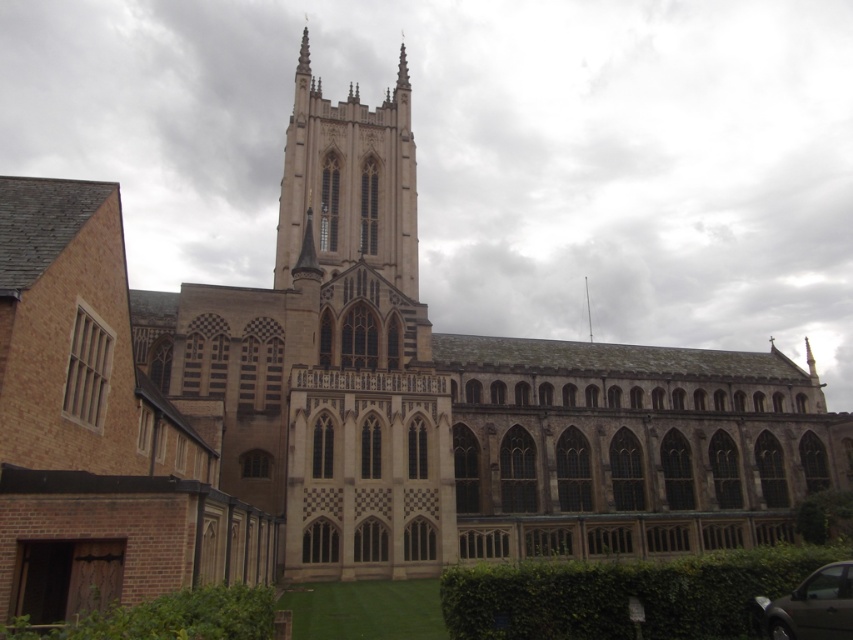
From the picture: Is beige stone tower at center thinner than metallic silver car at lower right?

In fact, beige stone tower at center might be wider than metallic silver car at lower right.

Who is more distant from viewer, (x=277, y=259) or (x=828, y=634)?

The point (x=277, y=259) is more distant.

Where is `beige stone tower at center`? This screenshot has width=853, height=640. beige stone tower at center is located at coordinates (349, 180).